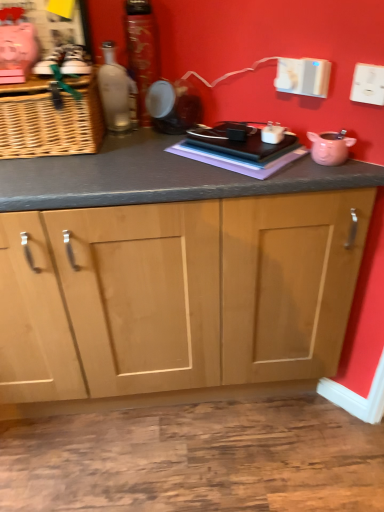
Question: From the image's perspective, relative to matte glass bottle at upper left, the 2th bottle viewed from the right, is shiny metallic can at center, which appears as the 2th bottle when viewed from the left, above or below?

Choices:
 (A) above
 (B) below

Answer: (A)

Question: Looking at their shapes, would you say shiny metallic can at center, the 1th bottle when ordered from right to left, is wider or thinner than matte glass bottle at upper left, the 1th bottle from the left?

Choices:
 (A) wide
 (B) thin

Answer: (A)

Question: Considering the real-world distances, which object is farthest from the matte black speaker at center, the 1th appliance when ordered from left to right?

Choices:
 (A) pink matte piggy bank at right, the second appliance in the left-to-right sequence
 (B) woven brown basket at left
 (C) matte glass bottle at upper left, the 2th bottle viewed from the right
 (D) shiny metallic can at center, the 1th bottle when ordered from right to left

Answer: (A)

Question: Which of these objects is positioned closest to the matte glass bottle at upper left, the 1th bottle from the left?

Choices:
 (A) shiny metallic can at center, the 1th bottle when ordered from right to left
 (B) woven brown basket at left
 (C) matte black speaker at center, which ranks as the 2th appliance in front-to-back order
 (D) pink matte piggy bank at right, which is the first appliance from bottom to top

Answer: (A)